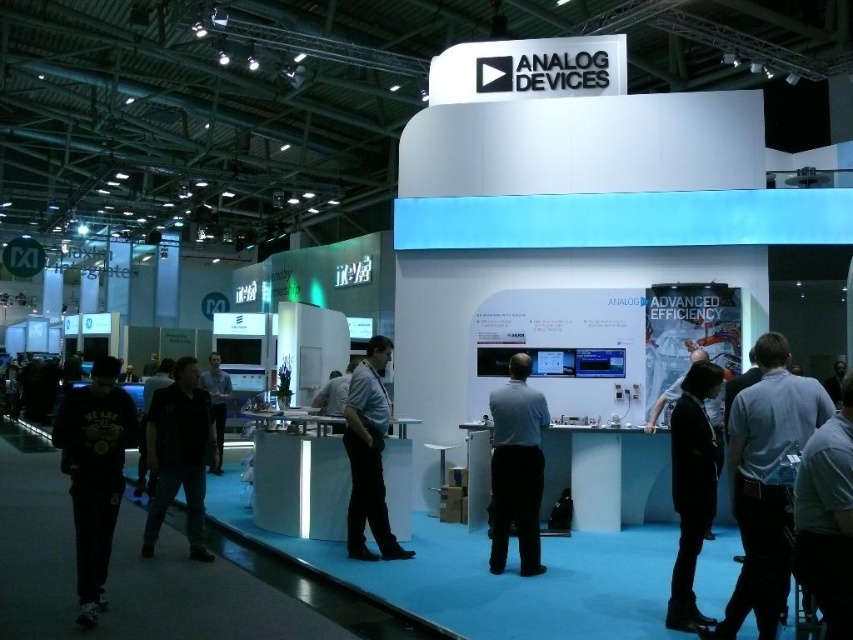
You are an event organizer at the Analog Devices booth and need to place a 1.2 meter wide banner between the black matte sweatshirt at left and the black leather jacket at lower right. Can the space accommodate the banner?

The black matte sweatshirt at left is narrower than the black leather jacket at lower right, but the total available space between them isn

You are standing at the entrance of the Analog Devices booth and want to move towards the point marked as point (96,602). There is an obstacle at point (688,625). Will you encounter the obstacle on your way?

Point (96,602) is in front of point (688,625), so you will reach point (96,602) before encountering the obstacle at point (688,625). Therefore, you will not encounter the obstacle on your way.

You are standing at the entrance of the Analog Devices booth and want to take a photo of the point at coordinates point (155,444). If your camera has a maximum focus range of 5 meters, will you be able to capture it clearly?

The point (155,444) is 5.33 meters away from the camera, which exceeds the camera maximum focus range of 5 meters. Therefore, the camera cannot capture it clearly.